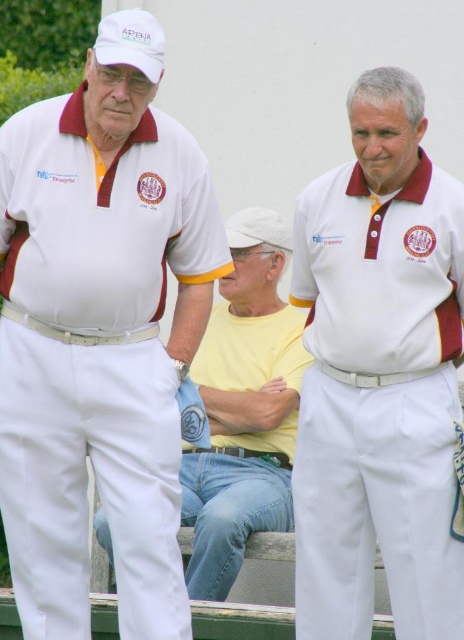
Question: Considering the real-world distances, which object is closest to the white cotton polo shirt at left?

Choices:
 (A) yellow cotton shirt at center
 (B) white cotton polo shirt at center

Answer: (B)

Question: Is white cotton polo shirt at left positioned in front of white matte polo shirt at center?

Choices:
 (A) no
 (B) yes

Answer: (B)

Question: Can you confirm if white cotton polo shirt at left is positioned below yellow cotton shirt at center?

Choices:
 (A) no
 (B) yes

Answer: (A)

Question: Is yellow cotton shirt at center positioned behind white matte polo shirt at center?

Choices:
 (A) no
 (B) yes

Answer: (B)

Question: Which point appears closest to the camera in this image?

Choices:
 (A) (337, 236)
 (B) (131, 572)
 (C) (277, 342)

Answer: (B)

Question: Which object appears farthest from the camera in this image?

Choices:
 (A) white cotton polo shirt at left
 (B) white matte polo shirt at center

Answer: (B)